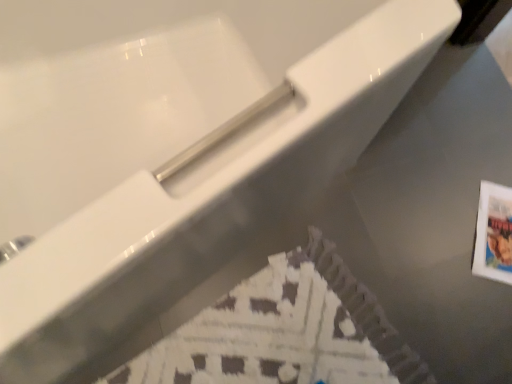
Question: Considering the relative sizes of white paper flyer at lower center and printed paper postcard at lower right in the image provided, is white paper flyer at lower center shorter than printed paper postcard at lower right?

Choices:
 (A) no
 (B) yes

Answer: (A)

Question: Would you consider white paper flyer at lower center to be distant from printed paper postcard at lower right?

Choices:
 (A) yes
 (B) no

Answer: (B)

Question: From a real-world perspective, is white paper flyer at lower center located beneath printed paper postcard at lower right?

Choices:
 (A) yes
 (B) no

Answer: (B)

Question: Is white paper flyer at lower center looking in the opposite direction of printed paper postcard at lower right?

Choices:
 (A) yes
 (B) no

Answer: (B)

Question: Is white paper flyer at lower center next to printed paper postcard at lower right?

Choices:
 (A) no
 (B) yes

Answer: (A)

Question: Could you tell me if white paper flyer at lower center is facing printed paper postcard at lower right?

Choices:
 (A) no
 (B) yes

Answer: (B)

Question: Can you confirm if printed paper postcard at lower right is shorter than white paper flyer at lower center?

Choices:
 (A) no
 (B) yes

Answer: (B)

Question: From a real-world perspective, is printed paper postcard at lower right on white paper flyer at lower center?

Choices:
 (A) yes
 (B) no

Answer: (B)

Question: Is printed paper postcard at lower right to the right of white paper flyer at lower center from the viewer's perspective?

Choices:
 (A) no
 (B) yes

Answer: (B)

Question: Would you say white paper flyer at lower center is part of printed paper postcard at lower right's contents?

Choices:
 (A) yes
 (B) no

Answer: (B)

Question: From the image's perspective, is printed paper postcard at lower right over white paper flyer at lower center?

Choices:
 (A) yes
 (B) no

Answer: (A)

Question: Can you confirm if printed paper postcard at lower right is smaller than white paper flyer at lower center?

Choices:
 (A) yes
 (B) no

Answer: (A)

Question: Considering their positions, is white paper flyer at lower center located in front of or behind printed paper postcard at lower right?

Choices:
 (A) behind
 (B) front

Answer: (B)